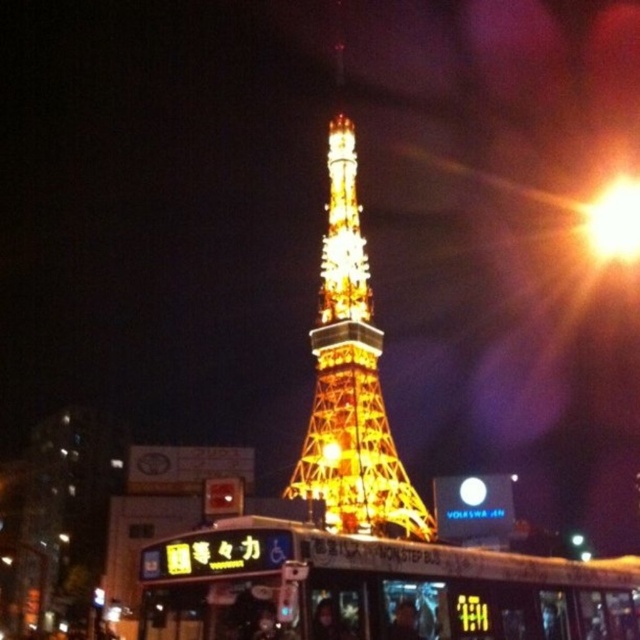
You are standing at the point with coordinates (349, 372) in the image. What object are you directly facing?

The point at coordinates (349, 372) corresponds to the gold metallic tower at center, so you are directly facing the gold metallic tower at center.

You are a tourist standing in front of the gold metallic tower at center and want to take a photo of it. There is a metallic gold bus at center blocking your view. Can you move to the left or right to get a clear shot of the tower without the bus?

Since the metallic gold bus at center is on the right side of the gold metallic tower at center, you should move to the left side of the tower to avoid the bus and get a clear view.

You are a tourist standing near the gold metallic tower at center and want to take a photo of the bright yellow light at upper right. Will the tower block your view of the light?

The gold metallic tower at center is in front of the bright yellow light at upper right, so it will block your view of the light.